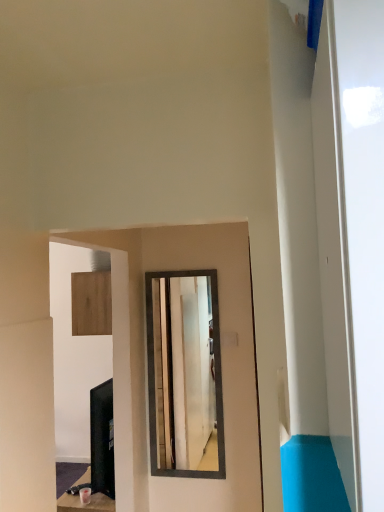
What is the approximate width of matte black mirror at center?

matte black mirror at center is 0.98 inches in width.

What do you see at coordinates (183, 371) in the screenshot?
I see `matte black mirror at center` at bounding box center [183, 371].

What are the coordinates of `matte black mirror at center` in the screenshot? It's located at (183, 371).

In order to face matte black mirror at center, should I rotate leftwards or rightwards?

Turn left approximately 1.033 degrees to face it.

This screenshot has height=512, width=384. What are the coordinates of `matte black mirror at center` in the screenshot? It's located at (183, 371).